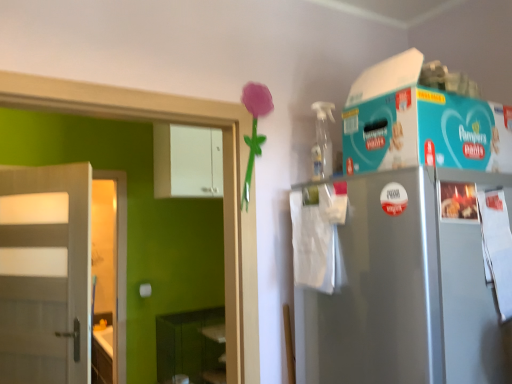
What do you see at coordinates (187, 161) in the screenshot? I see `white glossy cabinet at upper center` at bounding box center [187, 161].

Locate an element on the screen. Image resolution: width=512 pixels, height=384 pixels. white glossy cabinet at upper center is located at coordinates (187, 161).

Considering the sizes of objects green matte shelf at lower left and white glossy cabinet at upper center in the image provided, who is bigger, green matte shelf at lower left or white glossy cabinet at upper center?

green matte shelf at lower left.

Is green matte shelf at lower left not near white glossy cabinet at upper center?

Yes, green matte shelf at lower left and white glossy cabinet at upper center are quite far apart.

Is green matte shelf at lower left inside or outside of white glossy cabinet at upper center?

green matte shelf at lower left is not inside white glossy cabinet at upper center, it's outside.

Between green matte shelf at lower left and white glossy cabinet at upper center, which one has smaller width?

white glossy cabinet at upper center is thinner.

Is green matte shelf at lower left situated inside white matte door at left or outside?

green matte shelf at lower left cannot be found inside white matte door at left.

Which point is more distant from viewer, (x=175, y=314) or (x=11, y=205)?

Point (x=175, y=314)

Is green matte shelf at lower left aimed at white matte door at left?

No, green matte shelf at lower left does not turn towards white matte door at left.

From a real-world perspective, which object rests below the other?

From a 3D spatial view, green matte shelf at lower left is below.

Which of these two, white glossy cabinet at upper center or green matte shelf at lower left, stands taller?

With more height is green matte shelf at lower left.

Are white glossy cabinet at upper center and green matte shelf at lower left far apart?

Absolutely, white glossy cabinet at upper center is distant from green matte shelf at lower left.

Which is behind, point (202, 160) or point (157, 353)?

The point (157, 353) is farther from the camera.

Which object is positioned more to the right, white matte door at left or green matte shelf at lower left?

green matte shelf at lower left.

From the picture: Are white matte door at left and green matte shelf at lower left beside each other?

No.

Which of these two, white matte door at left or green matte shelf at lower left, is wider?

With larger width is green matte shelf at lower left.

Based on the photo, can you confirm if white matte door at left is taller than white glossy cabinet at upper center?

Indeed, white matte door at left has a greater height compared to white glossy cabinet at upper center.

Looking at this image, from the image's perspective, is white matte door at left located above white glossy cabinet at upper center?

No, from the image's perspective, white matte door at left is not on top of white glossy cabinet at upper center.

From a real-world perspective, is white matte door at left positioned over white glossy cabinet at upper center based on gravity?

No, from a real-world perspective, white matte door at left is not over white glossy cabinet at upper center

Considering the relative positions of white glossy cabinet at upper center and white matte door at left in the image provided, is white glossy cabinet at upper center to the left of white matte door at left from the viewer's perspective?

Incorrect, white glossy cabinet at upper center is not on the left side of white matte door at left.

How many degrees apart are the facing directions of white glossy cabinet at upper center and white matte door at left?

There is a 51.8-degree angle between the facing directions of white glossy cabinet at upper center and white matte door at left.

From the image's perspective, is white glossy cabinet at upper center above or below white matte door at left?

white glossy cabinet at upper center is situated higher than white matte door at left in the image.

Considering the sizes of white glossy cabinet at upper center and white matte door at left in the image, is white glossy cabinet at upper center wider or thinner than white matte door at left?

Clearly, white glossy cabinet at upper center has more width compared to white matte door at left.

At what (x,y) coordinates should I click in order to perform the action: click on shelf below the white glossy cabinet at upper center (from the image's perspective). Please return your answer as a coordinate pair (x, y). The image size is (512, 384). Looking at the image, I should click on (191, 347).

Find the location of a particular element. The height and width of the screenshot is (384, 512). door that appears on the left of green matte shelf at lower left is located at coordinates (45, 274).

Based on their spatial positions, is green matte shelf at lower left or white glossy cabinet at upper center further from white matte door at left?

Among the two, green matte shelf at lower left is located further to white matte door at left.

Estimate the real-world distances between objects in this image. Which object is further from green matte shelf at lower left, white glossy cabinet at upper center or white matte door at left?

The object further to green matte shelf at lower left is white glossy cabinet at upper center.

Estimate the real-world distances between objects in this image. Which object is further from white glossy cabinet at upper center, white matte door at left or green matte shelf at lower left?

Based on the image, green matte shelf at lower left appears to be further to white glossy cabinet at upper center.

Based on their spatial positions, is white glossy cabinet at upper center or green matte shelf at lower left closer to white matte door at left?

Based on the image, white glossy cabinet at upper center appears to be nearer to white matte door at left.

From the picture: Which object lies nearer to the anchor point green matte shelf at lower left, white matte door at left or white glossy cabinet at upper center?

white matte door at left.

Based on their spatial positions, is green matte shelf at lower left or white matte door at left further from white glossy cabinet at upper center?

green matte shelf at lower left.

You are a GUI agent. You are given a task and a screenshot of the screen. Output one action in this format:
    pyautogui.click(x=<x>, y=<y>)
    Task: Click on the door between white glossy cabinet at upper center and green matte shelf at lower left in the up-down direction
    The width and height of the screenshot is (512, 384).
    Given the screenshot: What is the action you would take?
    pyautogui.click(x=45, y=274)